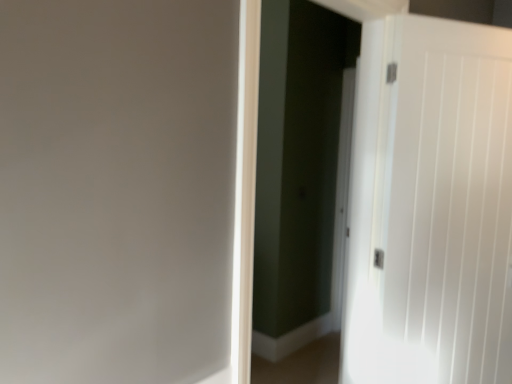
Question: In terms of size, does white glossy screen door at center appear bigger or smaller than white smooth door at right?

Choices:
 (A) small
 (B) big

Answer: (B)

Question: In terms of height, does white glossy screen door at center look taller or shorter compared to white smooth door at right?

Choices:
 (A) short
 (B) tall

Answer: (B)

Question: Is point (328, 268) positioned closer to the camera than point (497, 177)?

Choices:
 (A) farther
 (B) closer

Answer: (A)

Question: From the image's perspective, is white smooth door at right above or below white glossy screen door at center?

Choices:
 (A) above
 (B) below

Answer: (B)

Question: In terms of size, does white smooth door at right appear bigger or smaller than white glossy screen door at center?

Choices:
 (A) big
 (B) small

Answer: (B)

Question: Considering the positions of white smooth door at right and white glossy screen door at center in the image, is white smooth door at right wider or thinner than white glossy screen door at center?

Choices:
 (A) wide
 (B) thin

Answer: (B)

Question: Is point (359, 235) closer or farther from the camera than point (327, 299)?

Choices:
 (A) farther
 (B) closer

Answer: (B)